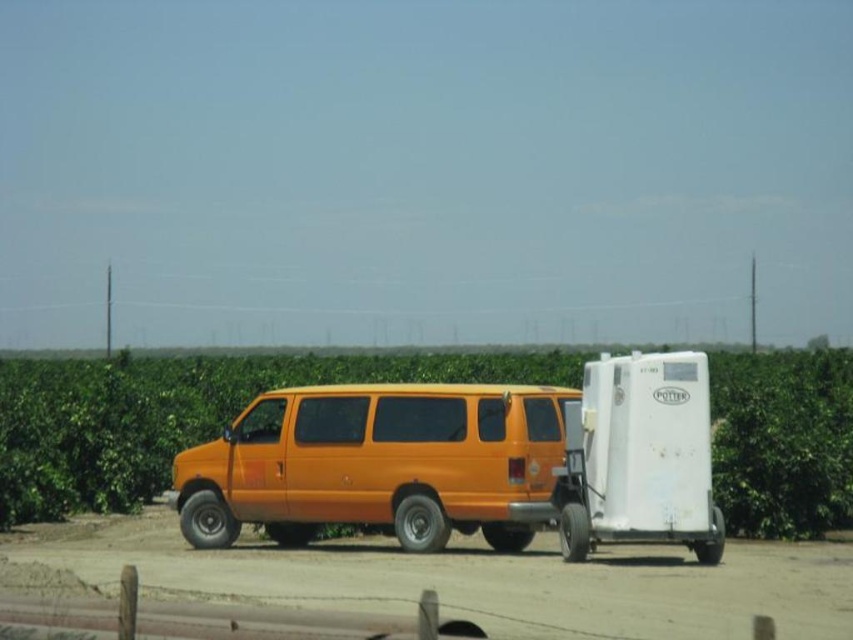
Question: Considering the relative positions of green leafy corn field at center and orange matte van at center in the image provided, where is green leafy corn field at center located with respect to orange matte van at center?

Choices:
 (A) above
 (B) below

Answer: (A)

Question: Does green leafy corn field at center come in front of orange matte van at center?

Choices:
 (A) no
 (B) yes

Answer: (B)

Question: Among these points, which one is farthest from the camera?

Choices:
 (A) (422, 513)
 (B) (849, 486)

Answer: (B)

Question: Among these points, which one is nearest to the camera?

Choices:
 (A) (485, 442)
 (B) (772, 474)

Answer: (A)

Question: Does green leafy corn field at center have a lesser width compared to orange matte van at center?

Choices:
 (A) no
 (B) yes

Answer: (A)